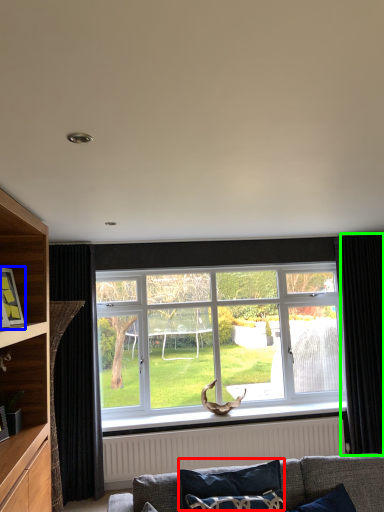
Question: Which object is positioned closest to pillow (highlighted by a red box)? Select from picture frame (highlighted by a blue box) and curtain (highlighted by a green box).

Choices:
 (A) picture frame
 (B) curtain

Answer: (A)